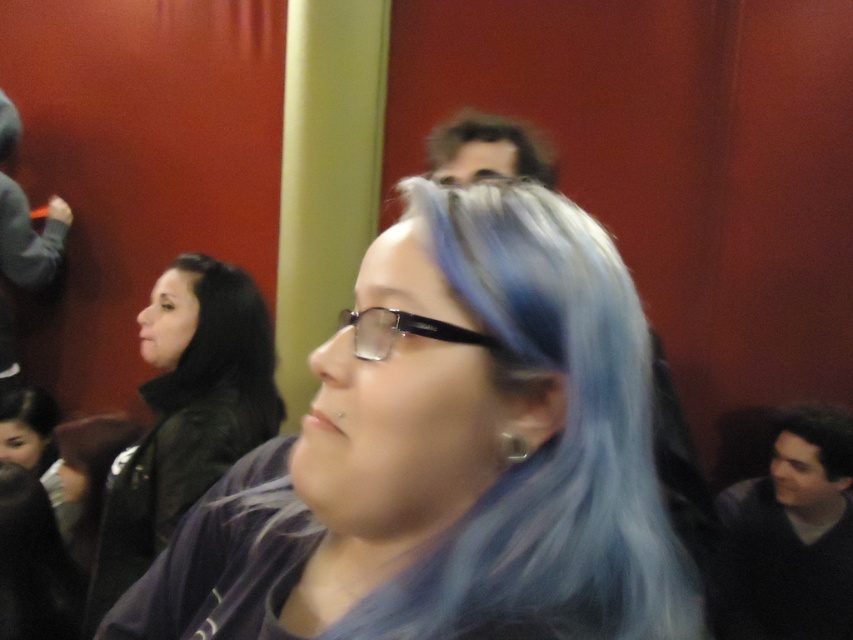
You are organizing a photo shoot in this classroom and need to place a small decorative item on the dark gray sweater at center and the dark brown hair at upper center. Which object requires a larger item to fit appropriately?

The dark gray sweater at center requires a larger item because it is larger in size than the dark brown hair at upper center.

You are a student in the classroom and want to see the board clearly. You have the black plastic glasses at center. However, the black leather jacket at upper left is blocking your view. Can you move the glasses to a position where they are no longer behind the jacket?

The black plastic glasses at center is currently behind the black leather jacket at upper left. To move them in front, you would need to physically adjust their positions so the glasses are no longer obstructed by the jacket.

You are a student in the classroom and need to locate your belongings. You remember leaving your black leather jacket at upper left and your black plastic glasses at center. According to the scene, is your jacket above or below your glasses?

The black leather jacket at upper left is positioned under the black plastic glasses at center, so the jacket is below your glasses.